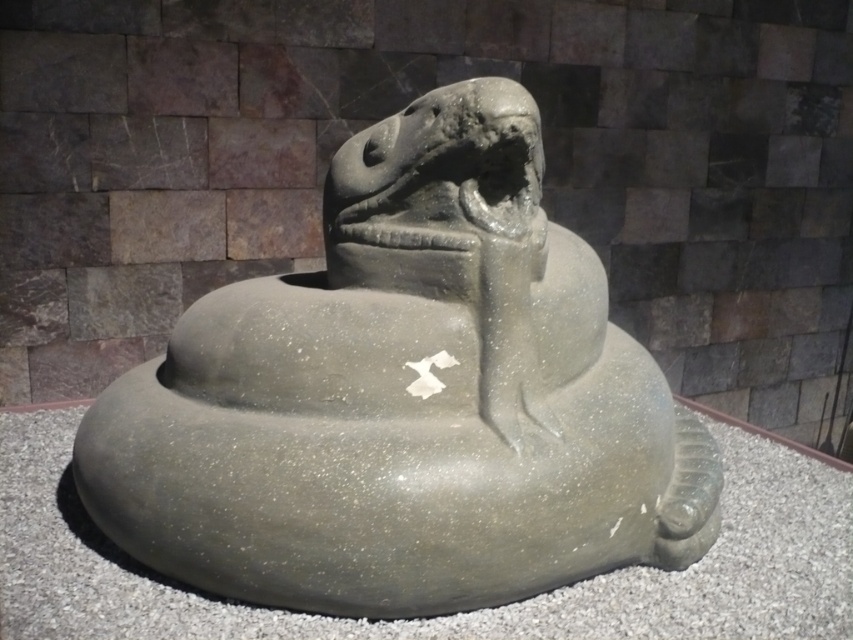
Question: Considering the relative positions of gray stone sculpture at center and gray speckled stone snake at center in the image provided, where is gray stone sculpture at center located with respect to gray speckled stone snake at center?

Choices:
 (A) left
 (B) right

Answer: (A)

Question: Is gray stone sculpture at center to the right of gray speckled stone snake at center from the viewer's perspective?

Choices:
 (A) no
 (B) yes

Answer: (A)

Question: Which point is farther from the camera taking this photo?

Choices:
 (A) (396, 186)
 (B) (26, 451)

Answer: (B)

Question: Does gray stone sculpture at center have a larger size compared to gray speckled stone snake at center?

Choices:
 (A) no
 (B) yes

Answer: (B)